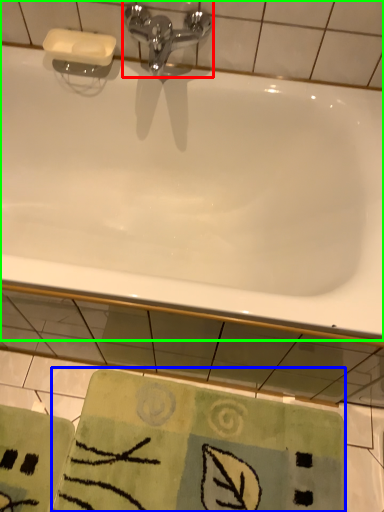
Question: Based on their relative distances, which object is nearer to tap (highlighted by a red box)? Choose from beach towel (highlighted by a blue box) and bathtub (highlighted by a green box).

Choices:
 (A) beach towel
 (B) bathtub

Answer: (B)